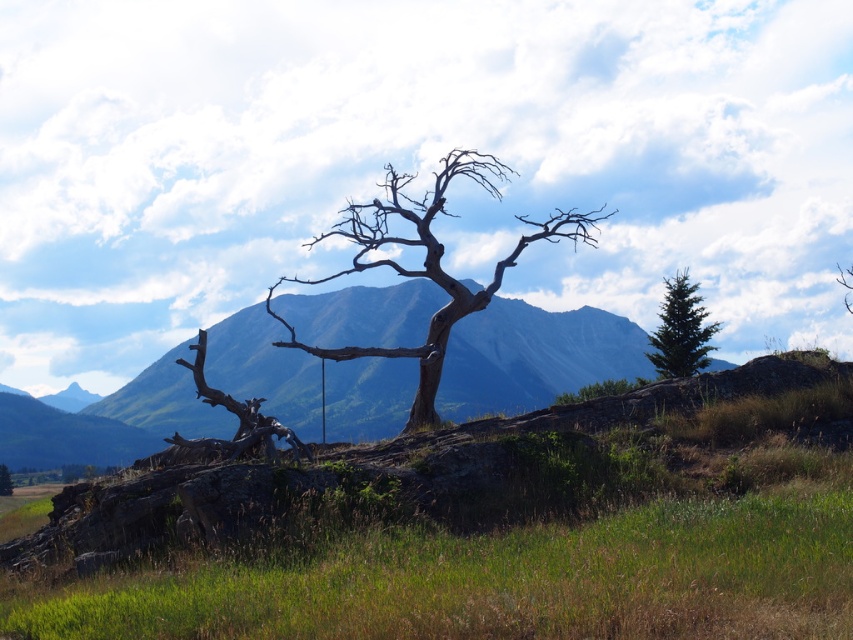
Question: Which object appears closest to the camera in this image?

Choices:
 (A) green rock at center
 (B) green glossy evergreen tree at upper right
 (C) brown rough tree trunk at center
 (D) green grassy at lower center

Answer: (D)

Question: Estimate the real-world distances between objects in this image. Which object is closer to the green grassy at lower center?

Choices:
 (A) green glossy evergreen tree at upper right
 (B) brown rough bark tree at center
 (C) brown rough tree trunk at center

Answer: (B)

Question: Can you confirm if green grassy at lower center is positioned to the left of brown rough bark tree at center?

Choices:
 (A) no
 (B) yes

Answer: (B)

Question: Is green grassy at lower center positioned at the back of brown rough tree trunk at center?

Choices:
 (A) yes
 (B) no

Answer: (B)

Question: Is green rock at center to the left of brown rough bark tree at center from the viewer's perspective?

Choices:
 (A) no
 (B) yes

Answer: (B)

Question: Among these objects, which one is farthest from the camera?

Choices:
 (A) green glossy evergreen tree at upper right
 (B) brown rough tree trunk at center
 (C) brown rough bark tree at center

Answer: (B)